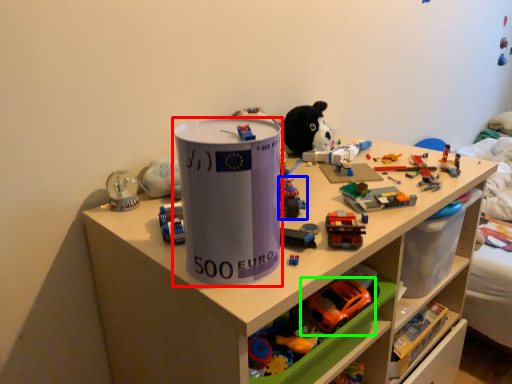
Question: Which object is the closest to the paper cup (highlighted by a red box)? Choose among these: toy (highlighted by a blue box) or toy (highlighted by a green box).

Choices:
 (A) toy
 (B) toy

Answer: (A)